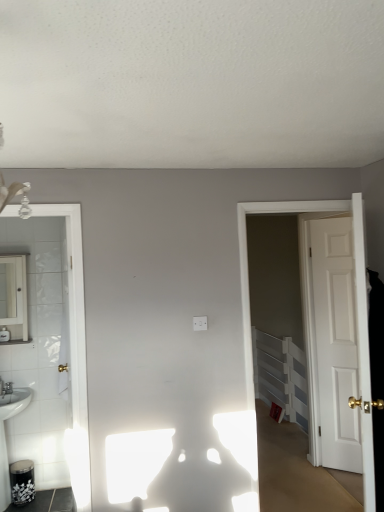
Question: In the image, is white glossy mirror at left positioned in front of or behind white plastic radiator at right?

Choices:
 (A) behind
 (B) front

Answer: (B)

Question: From the image's perspective, is white glossy mirror at left located above or below white plastic radiator at right?

Choices:
 (A) below
 (B) above

Answer: (B)

Question: Based on their relative distances, which object is nearer to the white plastic radiator at right?

Choices:
 (A) white glossy mirror at left
 (B) white matte door at right, the first door from the back
 (C) white glossy sink at lower left
 (D) white wooden door at right, which ranks as the 2th door in back-to-front order

Answer: (B)

Question: Considering the real-world distances, which object is farthest from the white wooden door at right, the first door positioned from the left?

Choices:
 (A) white plastic radiator at right
 (B) white glossy sink at lower left
 (C) white glossy mirror at left
 (D) white matte door at right, arranged as the 2th door when viewed from the front

Answer: (C)